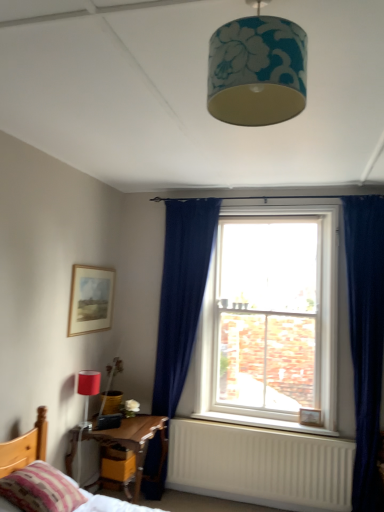
Find the location of a particular element. blank area to the left of wooden picture frame at lower right, the first picture frame from the back is located at coordinates (290, 425).